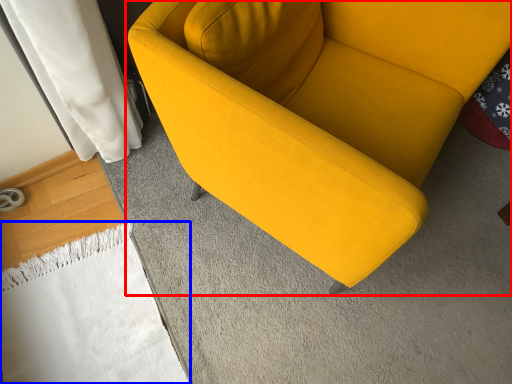
Question: Which of the following is the farthest to the observer, studio couch (highlighted by a red box) or blanket (highlighted by a blue box)?

Choices:
 (A) studio couch
 (B) blanket

Answer: (B)